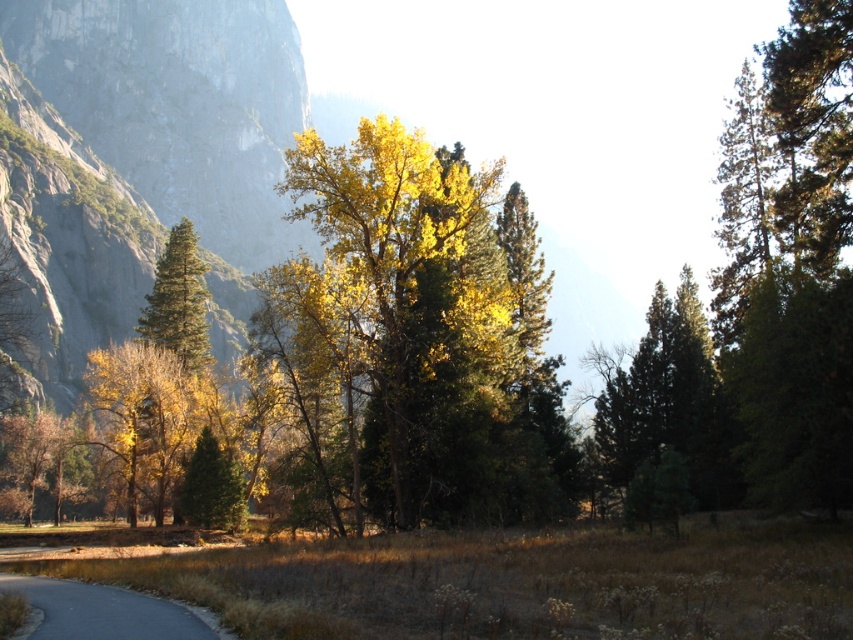
Question: Which of the following is the farthest from the observer?

Choices:
 (A) (474, 330)
 (B) (91, 627)
 (C) (229, 518)

Answer: (C)

Question: Which of the following is the farthest from the observer?

Choices:
 (A) pyautogui.click(x=183, y=636)
 (B) pyautogui.click(x=450, y=253)

Answer: (B)

Question: Can you confirm if gray asphalt road at lower left is positioned below green matte tree at center?

Choices:
 (A) yes
 (B) no

Answer: (B)

Question: Based on their relative distances, which object is farther from the green matte tree at center?

Choices:
 (A) gray asphalt road at lower left
 (B) yellow-green foliage at center

Answer: (A)

Question: Is yellow-green foliage at center in front of green matte tree at center?

Choices:
 (A) no
 (B) yes

Answer: (B)

Question: Does gray asphalt road at lower left have a smaller size compared to green matte tree at center?

Choices:
 (A) yes
 (B) no

Answer: (B)